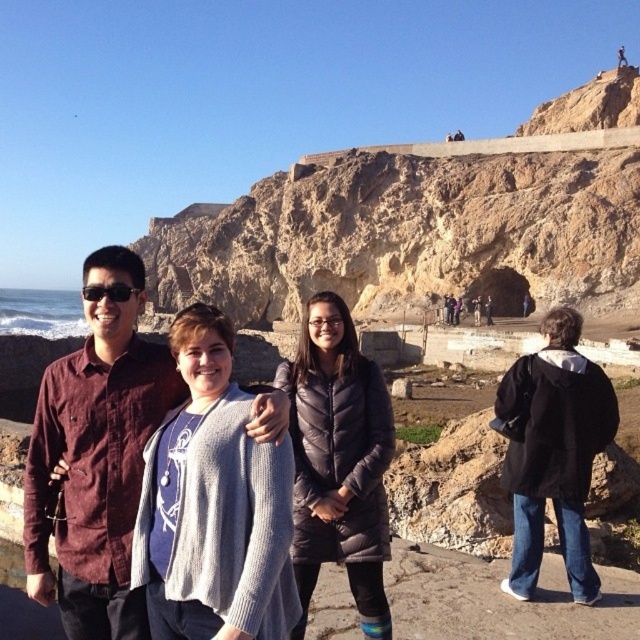
In the scene shown: You are a photographer trying to adjust the lighting for a photo shoot. The scene includes a gray knit sweater at center. Based on the coordinates provided, where exactly is the gray knit sweater positioned in the image?

The gray knit sweater at center is located at point (x=561, y=406) in the image.

You are a photographer trying to capture the entire scene in one shot. Given that the rustic stone cliff at upper center is wider than the gray knit sweater at center, which object should you focus on to ensure both are visible without cropping?

To ensure both the rustic stone cliff at upper center and the gray knit sweater at center are visible without cropping, focus on the gray knit sweater at center since it is narrower. This allows the wider rustic stone cliff at upper center to fit within the frame as well.

You are a photographer trying to capture a wide shot of the scene. Considering the rustic stone cliff at upper center and the black matte jacket at lower right, which object would require a wider angle lens to fully capture in the frame?

The rustic stone cliff at upper center would require a wider angle lens because its width is larger than the black matte jacket at lower right.